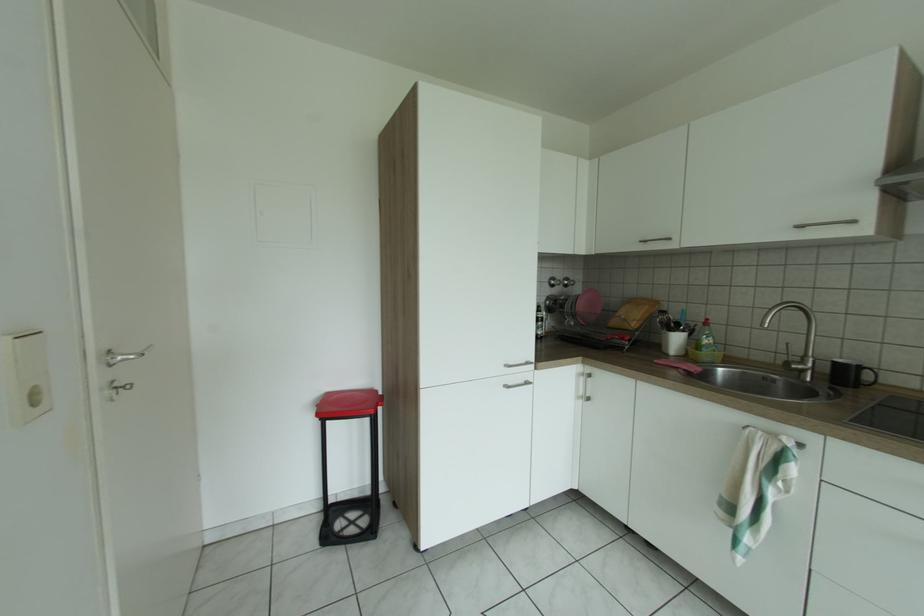
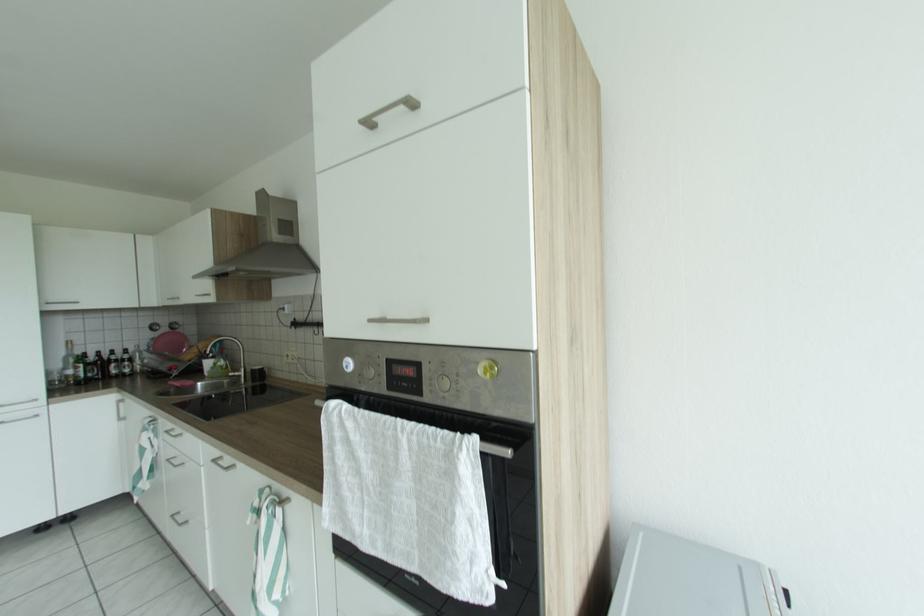
Consider the image. What movement of the cameraman would produce the second image?

The cameraman walked toward right, backward.